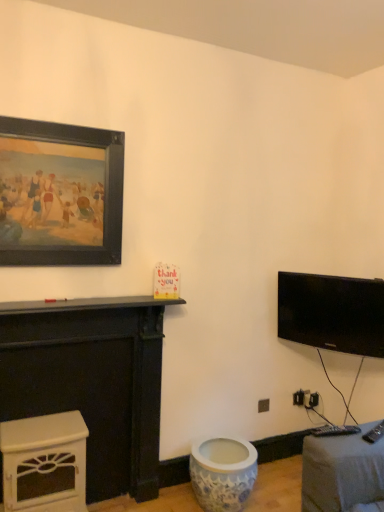
Question: Can you confirm if black glossy tv at upper right is bigger than black matte picture frame at upper left?

Choices:
 (A) no
 (B) yes

Answer: (B)

Question: Is black glossy tv at upper right wider than black matte picture frame at upper left?

Choices:
 (A) yes
 (B) no

Answer: (A)

Question: Is black glossy tv at upper right closer to the viewer compared to black matte picture frame at upper left?

Choices:
 (A) yes
 (B) no

Answer: (B)

Question: Does black glossy tv at upper right have a greater height compared to black matte picture frame at upper left?

Choices:
 (A) no
 (B) yes

Answer: (A)

Question: Is black glossy tv at upper right touching black matte picture frame at upper left?

Choices:
 (A) yes
 (B) no

Answer: (B)

Question: Is black glossy tv at upper right far from black matte picture frame at upper left?

Choices:
 (A) no
 (B) yes

Answer: (B)

Question: From a real-world perspective, is blue porcelain vase at lower center over black matte picture frame at upper left?

Choices:
 (A) yes
 (B) no

Answer: (B)

Question: Is blue porcelain vase at lower center wider than black matte picture frame at upper left?

Choices:
 (A) yes
 (B) no

Answer: (A)

Question: Can you confirm if blue porcelain vase at lower center is thinner than black matte picture frame at upper left?

Choices:
 (A) no
 (B) yes

Answer: (A)

Question: From the image's perspective, is blue porcelain vase at lower center above black matte picture frame at upper left?

Choices:
 (A) yes
 (B) no

Answer: (B)

Question: Is blue porcelain vase at lower center positioned beyond the bounds of black matte picture frame at upper left?

Choices:
 (A) no
 (B) yes

Answer: (B)

Question: Is blue porcelain vase at lower center aimed at black matte picture frame at upper left?

Choices:
 (A) no
 (B) yes

Answer: (A)

Question: Are blue porcelain vase at lower center and white glossy fireplace at lower left, which is counted as the 2th furniture, starting from the top, making contact?

Choices:
 (A) no
 (B) yes

Answer: (A)